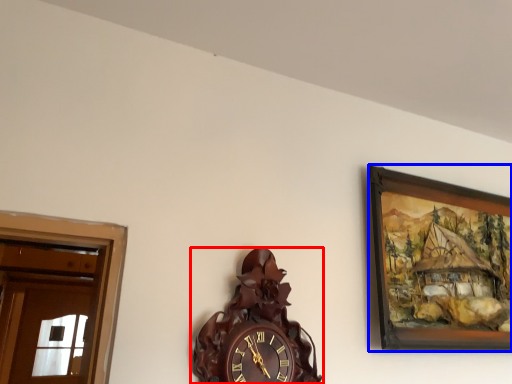
Question: Which object is closer to the camera taking this photo, wall clock (highlighted by a red box) or picture frame (highlighted by a blue box)?

Choices:
 (A) wall clock
 (B) picture frame

Answer: (A)